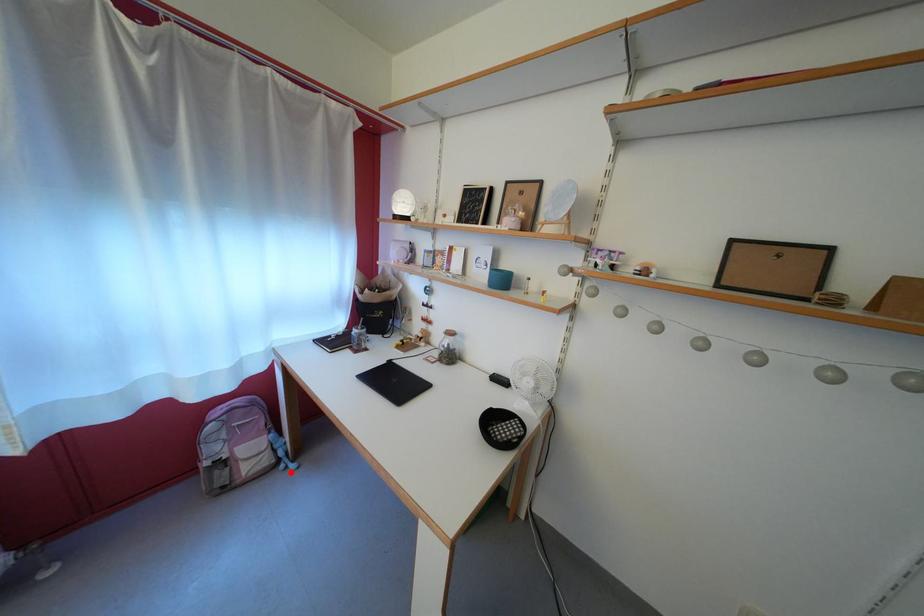
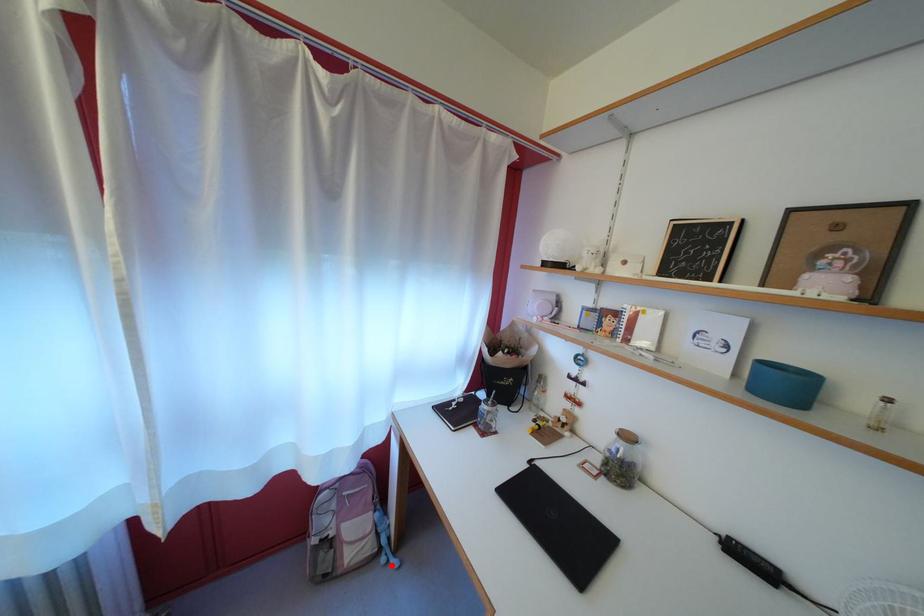
I am providing you with two images of the same scene from different viewpoints. A red point is marked on the first image and another point is marked on the second image. Are the points marked in image1 and image2 representing the same 3D position?

Yes